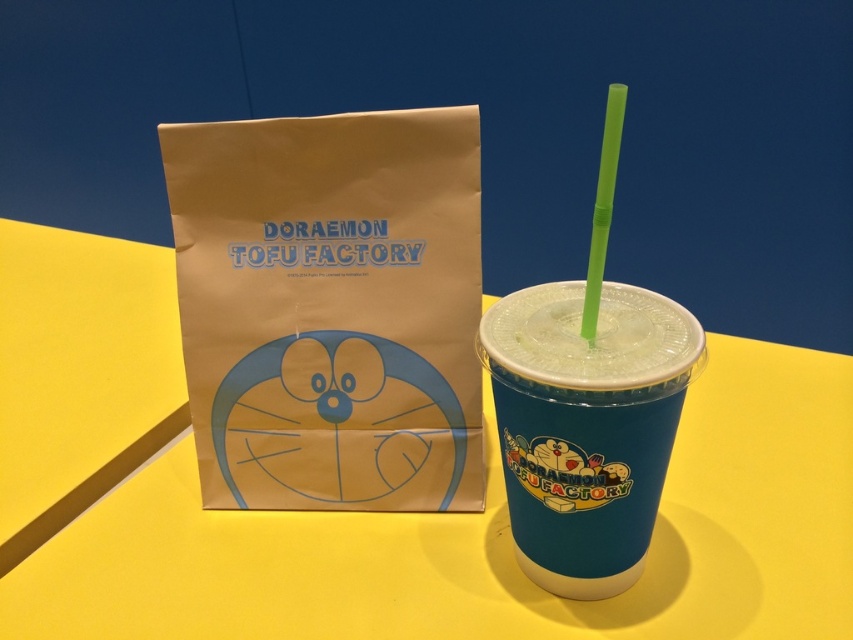
You are setting up a small snack station and have a blue plastic cup at center that needs to be placed on the yellow matte table at center. Based on the scene description, can the cup fit on the table?

The yellow matte table at center might be wider than blue plastic cup at center, so there is a possibility that the cup can fit on the table, but the exact dimensions are uncertain.

You are a photographer taking a picture of the scene. You notice two points in the image at coordinates point (x=685, y=337) and point (x=606, y=182). Which point is closer to the camera?

Point (x=685, y=337) is further to the camera than point (x=606, y=182), so point (x=606, y=182) is closer to the camera.

You are a delivery robot with a 6 inch wide arm. You need to place a package between the brown paper bag at center and the blue plastic cup at center. Can your arm fit through the space between them?

The distance between the brown paper bag at center and the blue plastic cup at center is 8.65 inches. Since your arm is 6 inches wide, it can fit through the space between them as 8.65 inches is wider than 6 inches.